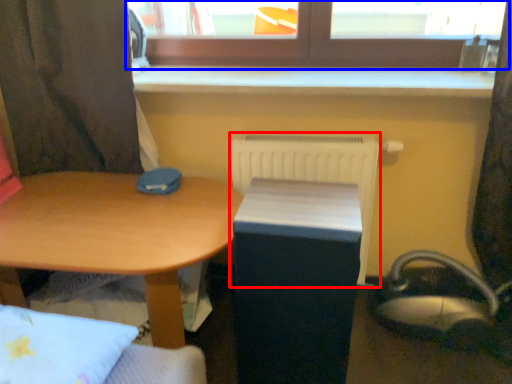
Question: Which of the following is the closest to the observer, radiator (highlighted by a red box) or window (highlighted by a blue box)?

Choices:
 (A) radiator
 (B) window

Answer: (B)